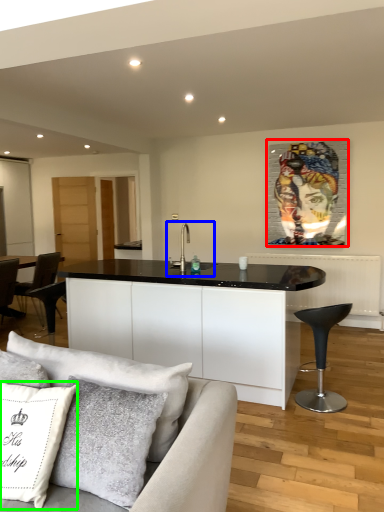
Question: Estimate the real-world distances between objects in this image. Which object is closer to picture frame (highlighted by a red box), sink (highlighted by a blue box) or pillow (highlighted by a green box)?

Choices:
 (A) sink
 (B) pillow

Answer: (A)